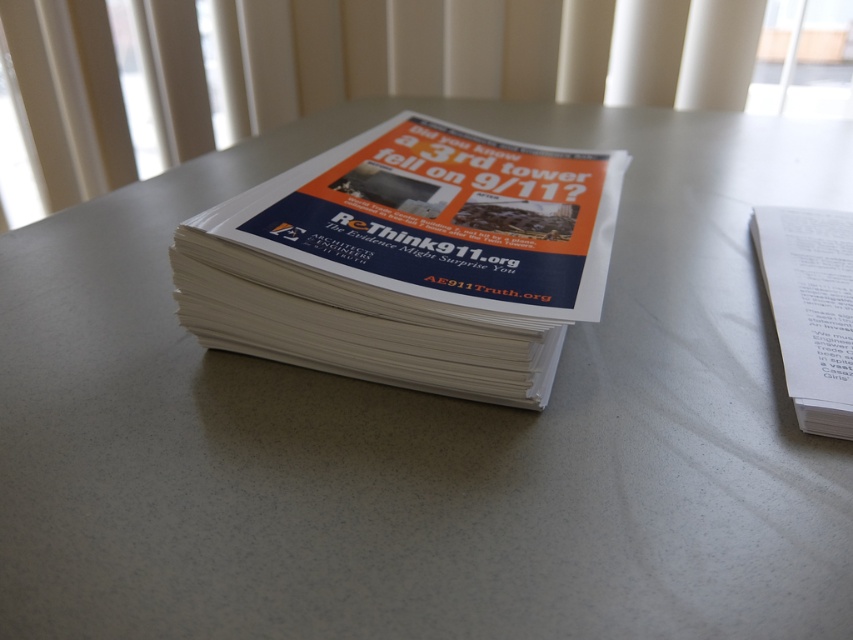
You are organizing a community event and have these two items on a table. You need to place a 40 cm wide decorative board between them. Can the board fit between the white paper flyer at center and the white paper at right without overlapping either?

The distance between the white paper flyer at center and the white paper at right is 41.40 centimeters. Since the board is 40 cm wide, it can fit between them without overlapping as there is enough space.

You are organizing printed materials on a table. You have a white paper flyer at center and a white paper at right. Which one is covering part of the other?

The white paper flyer at center is positioned over the white paper at right, so it is covering part of it.